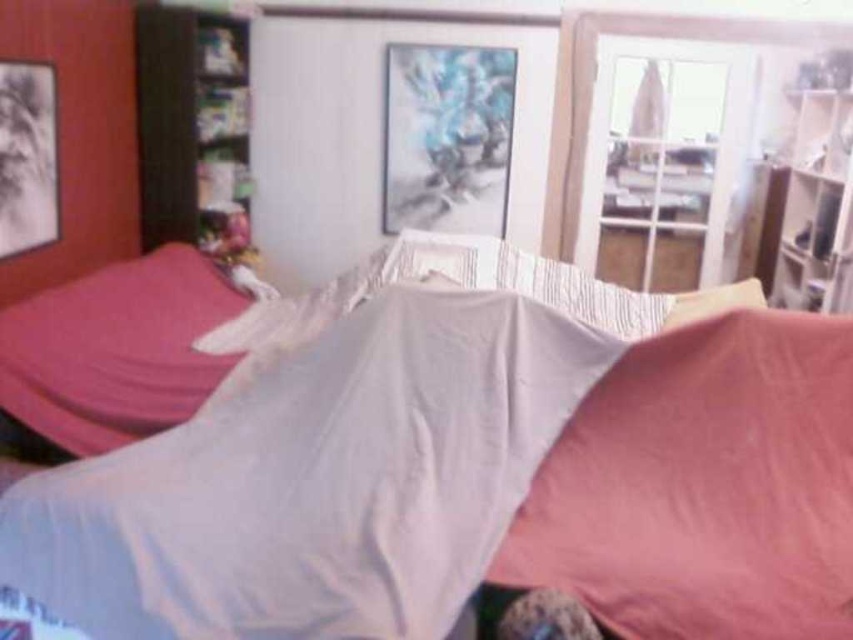
You are organizing a small event in the bedroom and need to decide which item to use for decoration. Since you want something bigger, which object should you choose between the white fabric sheet at center and the pink fabric pillow at lower right?

The white fabric sheet at center is larger in size than the pink fabric pillow at lower right, so you should choose the white fabric sheet at center for decoration.

You are trying to make the bed in the bedroom scene. The white fabric sheet at center needs to be placed correctly. Where should you position it relative to the pink fabric pillow at lower right?

The white fabric sheet at center should be placed above the pink fabric pillow at lower right as it is located above it.

You are standing in the bedroom scene described. There is a point marked at coordinates (704, 486). What object is located at this point?

The point at coordinates (704, 486) marks the pink fabric pillow at lower right.